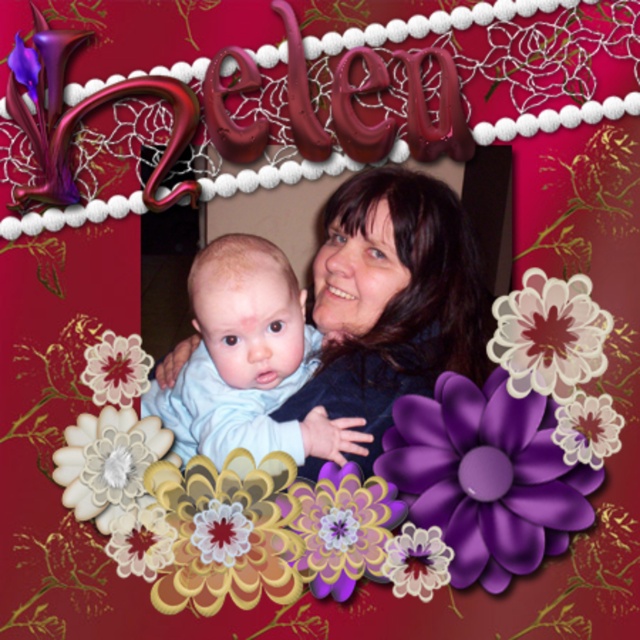
Can you confirm if shiny purple flower at lower right is positioned to the left of purple matte flower at center?

Incorrect, shiny purple flower at lower right is not on the left side of purple matte flower at center.

Measure the distance between point (x=492, y=374) and camera.

A distance of 99.05 centimeters exists between point (x=492, y=374) and camera.

Identify the location of shiny purple flower at lower right. pos(486,476).

Looking at this image, who is positioned more to the left, matte blue shirt at center or purple glossy flower at center?

matte blue shirt at center

The image size is (640, 640). Describe the element at coordinates (392, 298) in the screenshot. I see `matte blue shirt at center` at that location.

Measure the distance between matte blue shirt at center and camera.

matte blue shirt at center and camera are 1.05 meters apart from each other.

Find the location of `matte blue shirt at center`. matte blue shirt at center is located at coordinates (392, 298).

Is point (522, 337) farther from viewer compared to point (381, 568)?

That is False.

Does white paper flower at center appear under purple glossy flower at lower center?

Incorrect, white paper flower at center is not positioned below purple glossy flower at lower center.

In the scene shown: Who is more distant from viewer, (x=573, y=337) or (x=397, y=547)?

Positioned behind is point (x=397, y=547).

Identify the location of white paper flower at center. (548, 336).